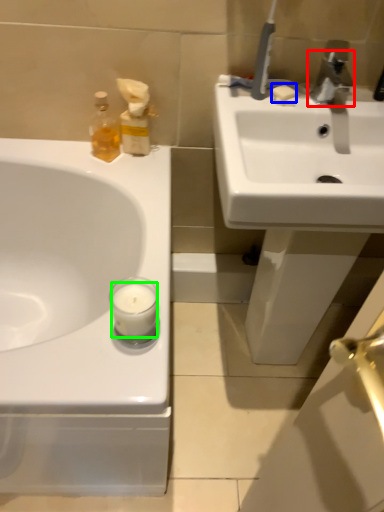
Question: Considering the real-world distances, which object is farthest from tap (highlighted by a red box)? soap (highlighted by a blue box) or candle (highlighted by a green box)?

Choices:
 (A) soap
 (B) candle

Answer: (B)